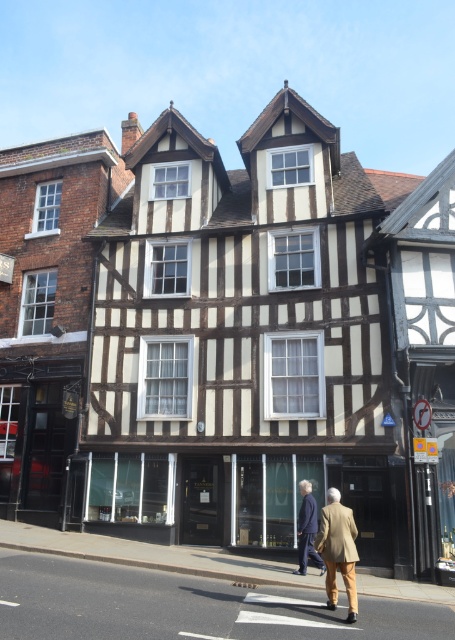
Is light brown leather jacket at lower center below light brown leather jacket at center?

Actually, light brown leather jacket at lower center is above light brown leather jacket at center.

Is point (343, 580) positioned after point (318, 566)?

No, (343, 580) is in front of (318, 566).

Between point (342, 532) and point (313, 499), which one is positioned behind?

The point (313, 499) is more distant.

The height and width of the screenshot is (640, 455). I want to click on light brown leather jacket at lower center, so click(x=338, y=550).